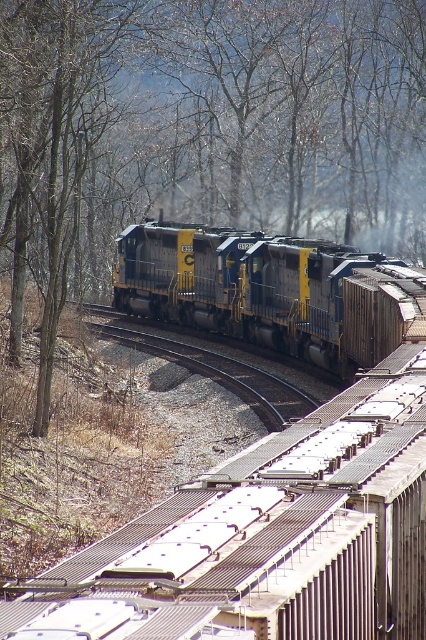
Can you confirm if blue/yellow locomotive at center is shorter than metal/smooth train track at center?

No.

Can you confirm if blue/yellow locomotive at center is positioned above metal/smooth train track at center?

Correct, blue/yellow locomotive at center is located above metal/smooth train track at center.

The height and width of the screenshot is (640, 426). I want to click on blue/yellow locomotive at center, so click(264, 289).

Is brown bark tree at upper left to the right of metal/smooth train track at center from the viewer's perspective?

Correct, you'll find brown bark tree at upper left to the right of metal/smooth train track at center.

Can you confirm if brown bark tree at upper left is positioned to the left of metal/smooth train track at center?

In fact, brown bark tree at upper left is to the right of metal/smooth train track at center.

Find the location of a particular element. The image size is (426, 640). brown bark tree at upper left is located at coordinates (203, 129).

Who is lower down, brown bark tree at upper left or blue/yellow locomotive at center?

blue/yellow locomotive at center is lower down.

Between brown bark tree at upper left and blue/yellow locomotive at center, which one has more height?

brown bark tree at upper left

Who is more distant from viewer, (69, 227) or (345, 253)?

The point (345, 253) is behind.

At what (x,y) coordinates should I click in order to perform the action: click on brown bark tree at upper left. Please return your answer as a coordinate pair (x, y). The height and width of the screenshot is (640, 426). Looking at the image, I should click on (203, 129).